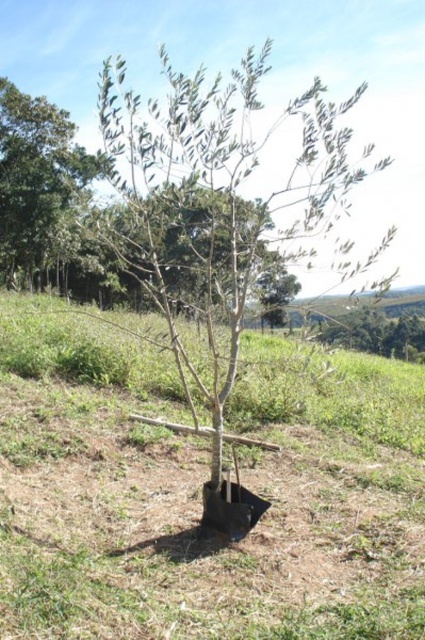
You are standing in a rural area and want to walk towards the green grass at center and the green matte tree at center. Which one will you reach first?

You will reach the green grass at center first because it is closer to you than the green matte tree at center.